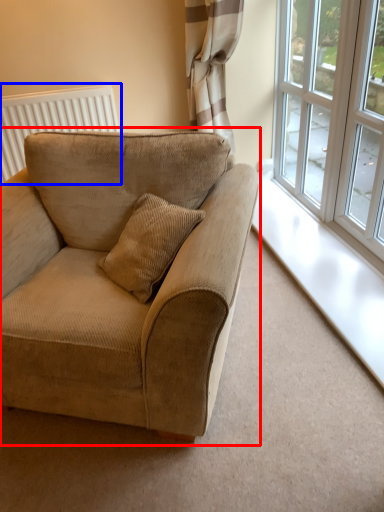
Question: Which object is closer to the camera taking this photo, studio couch (highlighted by a red box) or radiator (highlighted by a blue box)?

Choices:
 (A) studio couch
 (B) radiator

Answer: (A)